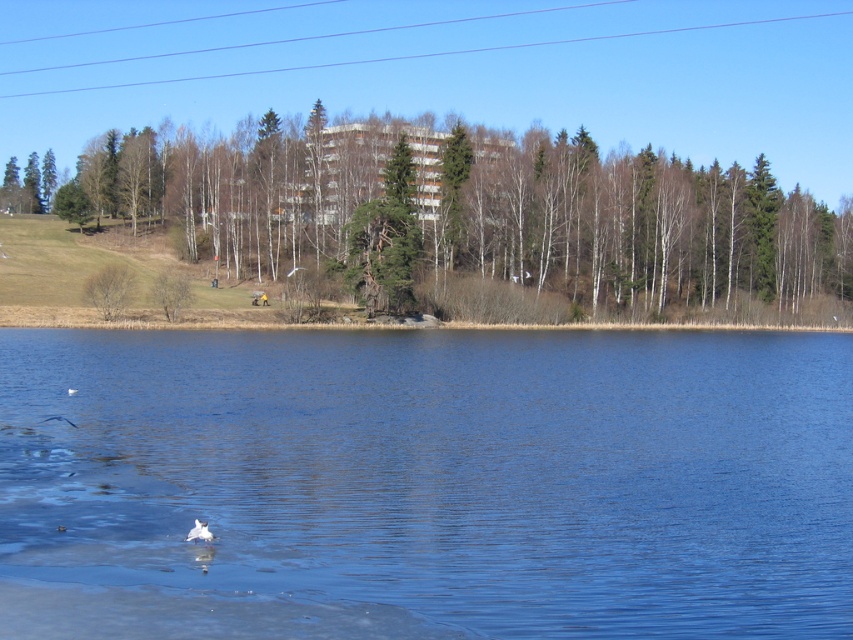
Question: Which of the following is the farthest from the observer?

Choices:
 (A) green matte tree at lower left
 (B) white matte bird at lower left
 (C) white feathered bird at lower left

Answer: (A)

Question: Which of the following is the farthest from the observer?

Choices:
 (A) (108, 312)
 (B) (68, 392)

Answer: (A)

Question: Can you confirm if white feathered bird at lower center is wider than white feathered bird at lower left?

Choices:
 (A) yes
 (B) no

Answer: (B)

Question: Which object is the farthest from the green matte tree at lower left?

Choices:
 (A) white feathered bird at lower center
 (B) green leafy tree at center

Answer: (A)

Question: Does white feathered bird at lower center have a greater width compared to white matte bird at lower left?

Choices:
 (A) yes
 (B) no

Answer: (B)

Question: Is blue water at lower center positioned in front of white matte bird at lower left?

Choices:
 (A) yes
 (B) no

Answer: (A)